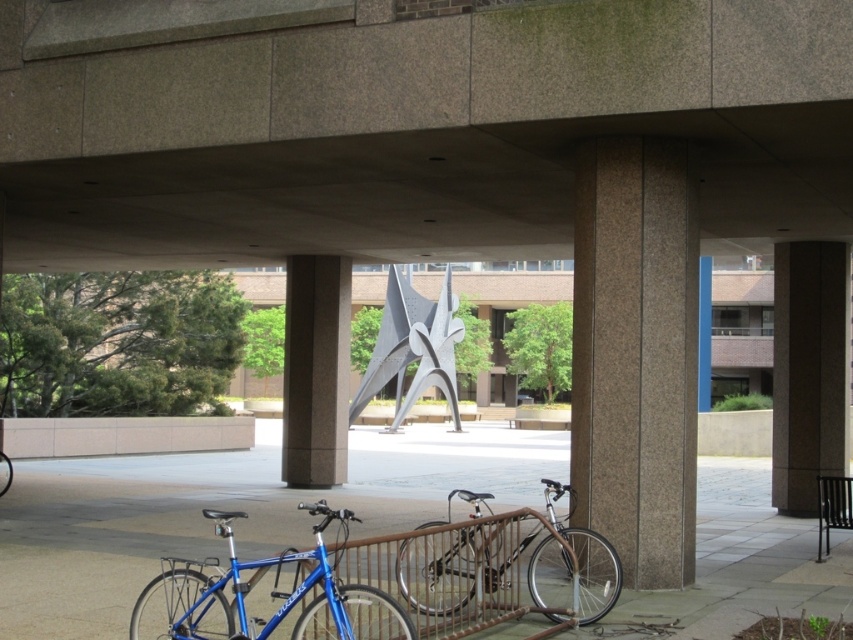
Question: Does gray concrete pavement at center appear on the right side of matte blue bicycle at lower left?

Choices:
 (A) yes
 (B) no

Answer: (A)

Question: From the image, what is the correct spatial relationship of smooth concrete pillar at center in relation to silver metallic bicycle at center?

Choices:
 (A) right
 (B) left

Answer: (A)

Question: In this image, where is brown textured pillar at right located relative to blue metallic bicycle at lower left?

Choices:
 (A) below
 (B) above

Answer: (B)

Question: Estimate the real-world distances between objects in this image. Which object is closer to the gray concrete pillar at center?

Choices:
 (A) concrete overpass at center
 (B) gray concrete pavement at center

Answer: (B)

Question: Which point is closer to the camera taking this photo?

Choices:
 (A) pos(646,154)
 (B) pos(529,540)
 (C) pos(9,630)
 (D) pos(322,310)

Answer: (C)

Question: Estimate the real-world distances between objects in this image. Which object is farther from the gray concrete pillar at center?

Choices:
 (A) concrete overpass at center
 (B) silver metallic bicycle at center
 (C) matte blue bicycle at lower left

Answer: (C)